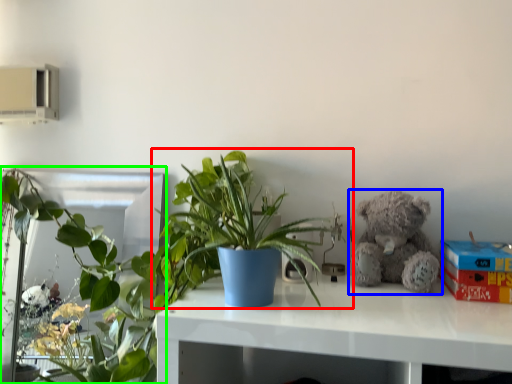
Question: Based on their relative distances, which object is nearer to houseplant (highlighted by a red box)? Choose from teddy bear (highlighted by a blue box) and houseplant (highlighted by a green box).

Choices:
 (A) teddy bear
 (B) houseplant

Answer: (A)